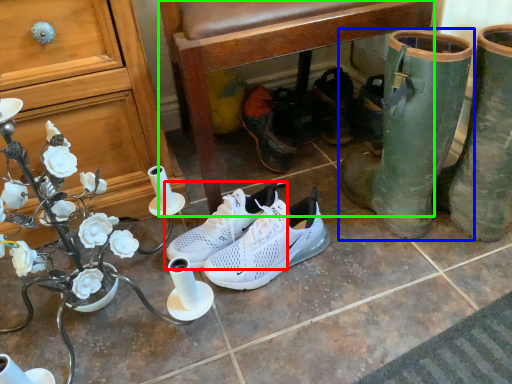
Question: Based on their relative distances, which object is nearer to footwear (highlighted by a red box)? Choose from footwear (highlighted by a blue box) and chair (highlighted by a green box).

Choices:
 (A) footwear
 (B) chair

Answer: (B)